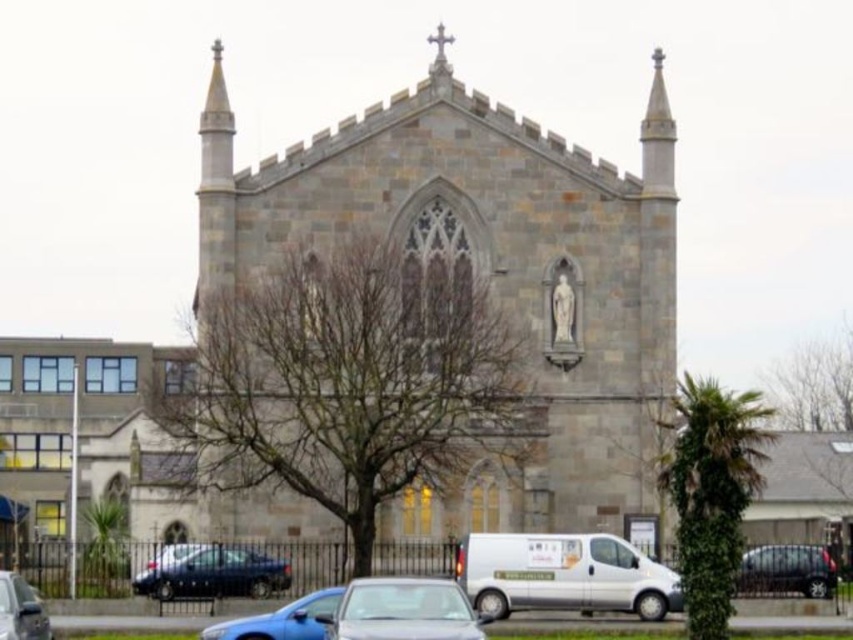
Question: Is blue metallic car at center below shiny black car at lower right?

Choices:
 (A) no
 (B) yes

Answer: (B)

Question: Which object is closer to the camera taking this photo?

Choices:
 (A) shiny black car at lower right
 (B) metallic blue sedan at lower center

Answer: (B)

Question: Which object appears closest to the camera in this image?

Choices:
 (A) blue metallic car at center
 (B) gray stone chapel at center

Answer: (A)

Question: Does white metallic van at lower center appear under shiny black sedan at lower left?

Choices:
 (A) yes
 (B) no

Answer: (A)

Question: Which object is closer to the camera taking this photo?

Choices:
 (A) white metallic van at lower center
 (B) blue metallic car at center

Answer: (B)

Question: Does white metallic van at lower center have a greater width compared to blue metallic car at center?

Choices:
 (A) yes
 (B) no

Answer: (A)